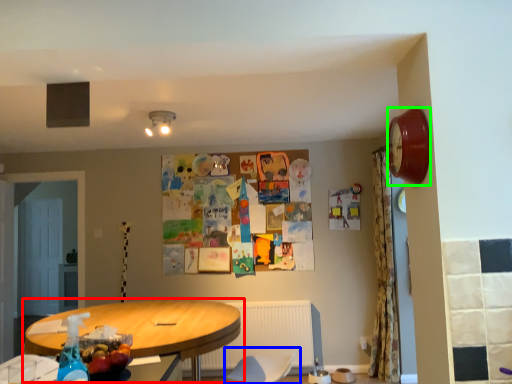
Question: Which is farther away from table (highlighted by a red box)? swivel chair (highlighted by a blue box) or clock (highlighted by a green box)?

Choices:
 (A) swivel chair
 (B) clock

Answer: (B)